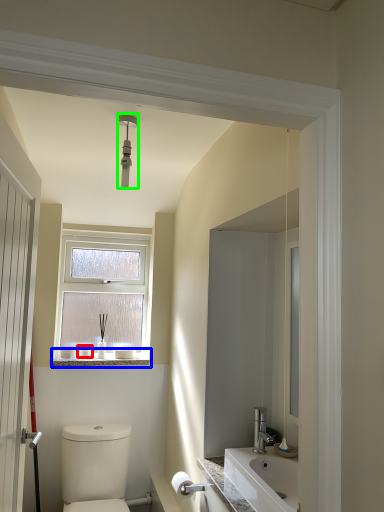
Question: Based on their relative distances, which object is nearer to toiletry (highlighted by a red box)? Choose from window sill (highlighted by a blue box) and light fixture (highlighted by a green box).

Choices:
 (A) window sill
 (B) light fixture

Answer: (A)